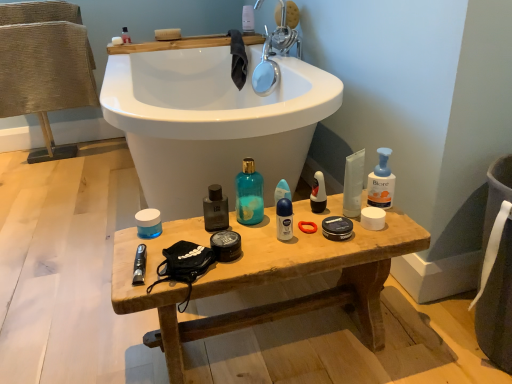
Where is `vacant space in between translucent plastic jar at center, arranged as the 3th toiletry when viewed from the front, and matte black bottle at center, positioned as the 2th toiletry in front-to-back order`? This screenshot has width=512, height=384. vacant space in between translucent plastic jar at center, arranged as the 3th toiletry when viewed from the front, and matte black bottle at center, positioned as the 2th toiletry in front-to-back order is located at coordinates (182, 227).